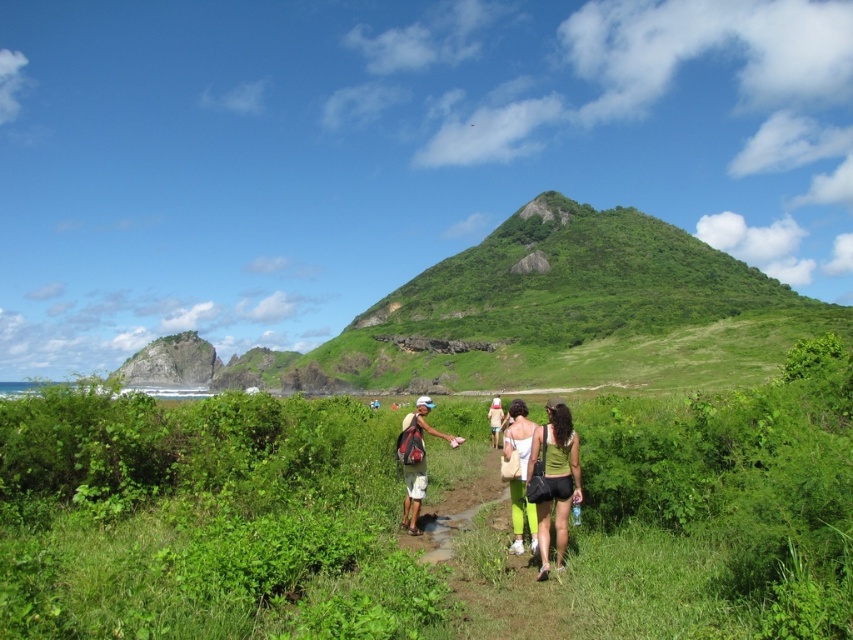
From the picture: You are a hiker trying to follow a group of people walking along the path. You notice two people wearing matte green pants at center and matte khaki shorts at center. Which clothing item is lower in position compared to the other?

The matte green pants at center is located below matte khaki shorts at center, so the matte green pants at center is lower in position.

You are standing at the starting point of the dirt path in the foreground. You want to reach the green grassy hill at upper center. According to the coordinates provided, in which direction should you walk to reach it?

The green grassy hill at upper center is located at coordinates point (560, 314). Since the y coordinate is 0.657, which is above the center point of 0.5, you should walk upwards to reach it.

You are a hiker on the narrow dirt path and see the matte green pants at center and the matte khaki shorts at center ahead of you. Which one is closer to you?

The matte green pants at center is in front of the matte khaki shorts at center, so the matte green pants at center is closer to you.